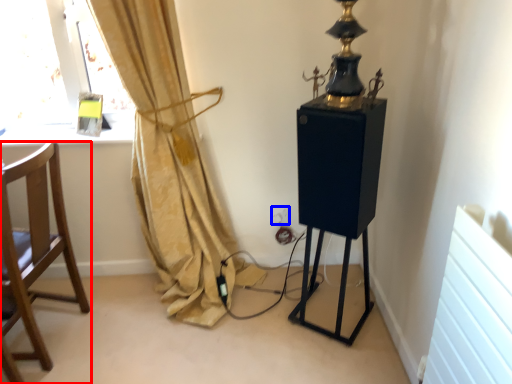
Question: Among these objects, which one is farthest to the camera, chair (highlighted by a red box) or electric outlet (highlighted by a blue box)?

Choices:
 (A) chair
 (B) electric outlet

Answer: (B)